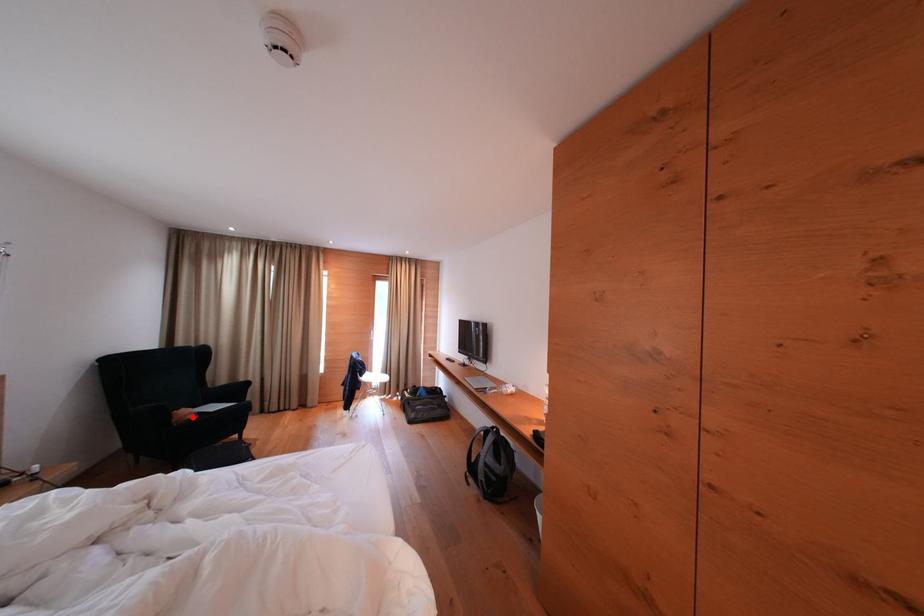
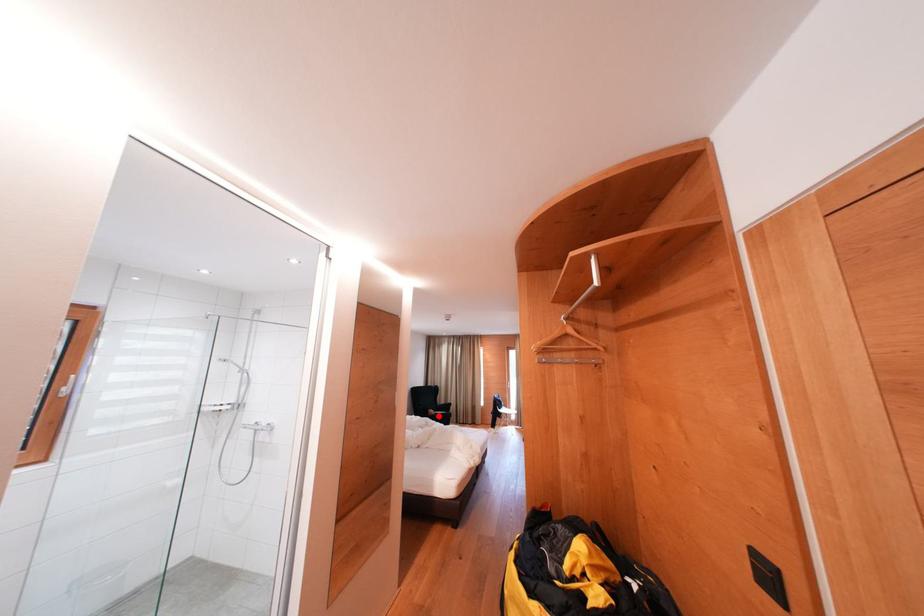
I am providing you with two images of the same scene from different viewpoints. A red point is marked on the first image and another point is marked on the second image. Are the points marked in image1 and image2 representing the same 3D position?

Yes